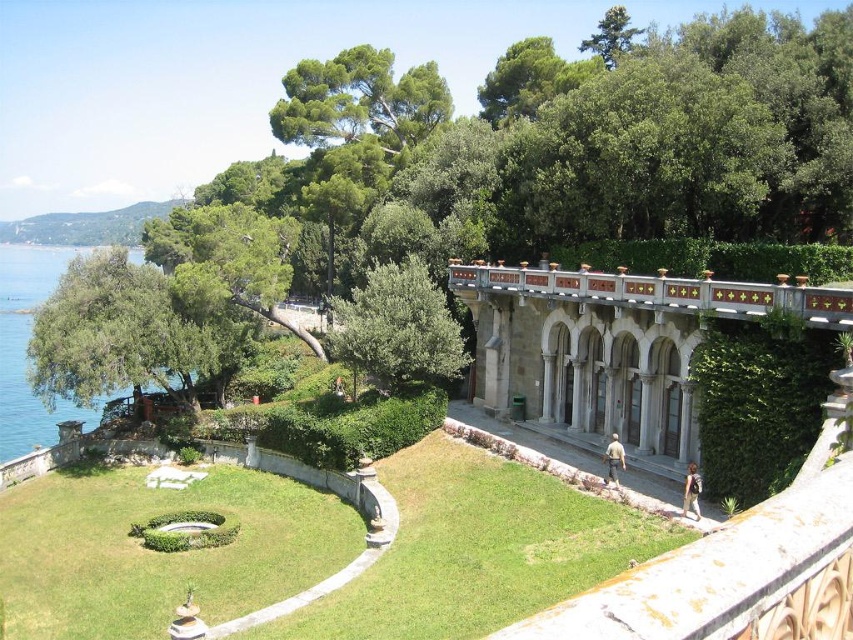
You are a landscape architect designing a new garden. You need to ensure that the white stone archway at center is visible from the green water at left. Based on the scene description, will the archway be visible from the water? Explain your reasoning.

The white stone archway at center is shorter than the green water at left. Since the archway is shorter, it may be partially or fully obscured by the water level, making it less visible from the water. However, visibility also depends on the terrain slope and the exact positioning between the two elements.

You are standing at the entrance of the villa and want to take a photo of the white stone archway at center. If the camera has a 60 degree field of view, will the archway be fully visible in the photo?

The white stone archway at center is located at point (648,362) in the image. Since the camera has a 60 degree field of view, it depends on the distance from the entrance to the archway. Without knowing the exact distance, we cannot determine if the archway will be fully visible.